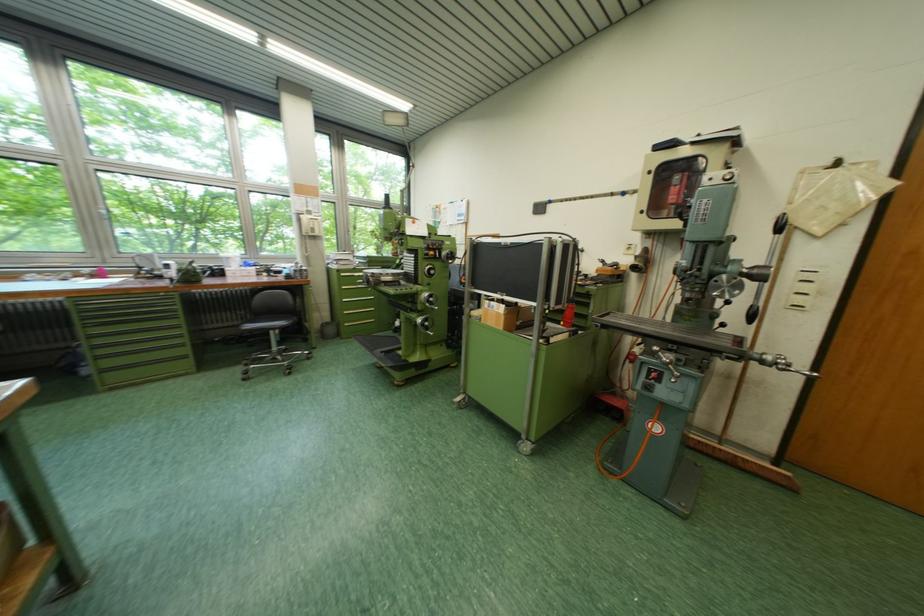
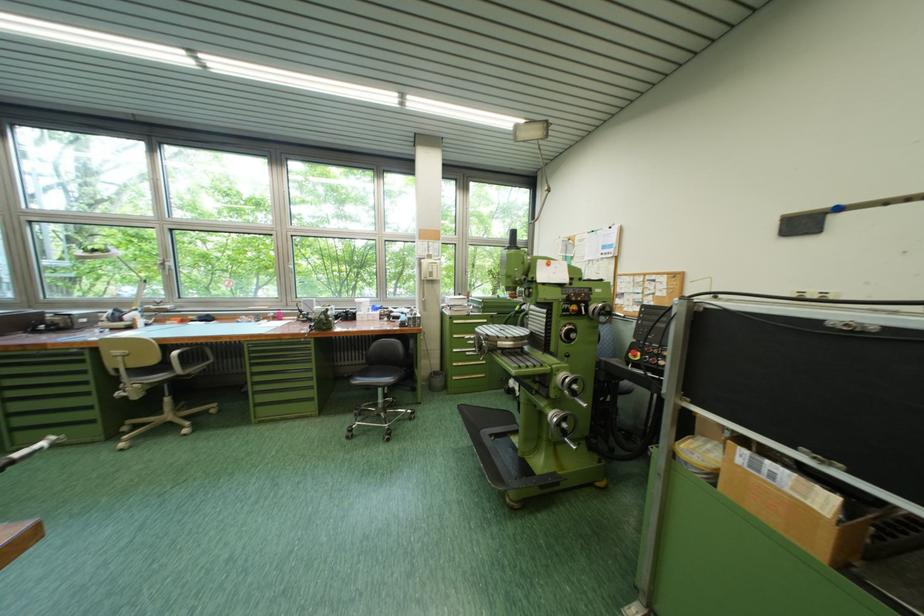
Which direction would the cameraman need to move to produce the second image?

The cameraman moved toward left, forward.